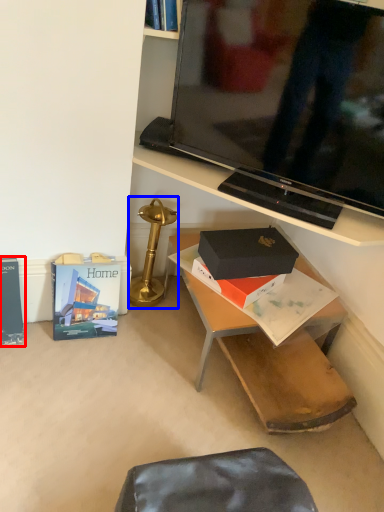
Question: Which object appears closest to the camera in this image, paperback book (highlighted by a red box) or table lamp (highlighted by a blue box)?

Choices:
 (A) paperback book
 (B) table lamp

Answer: (A)